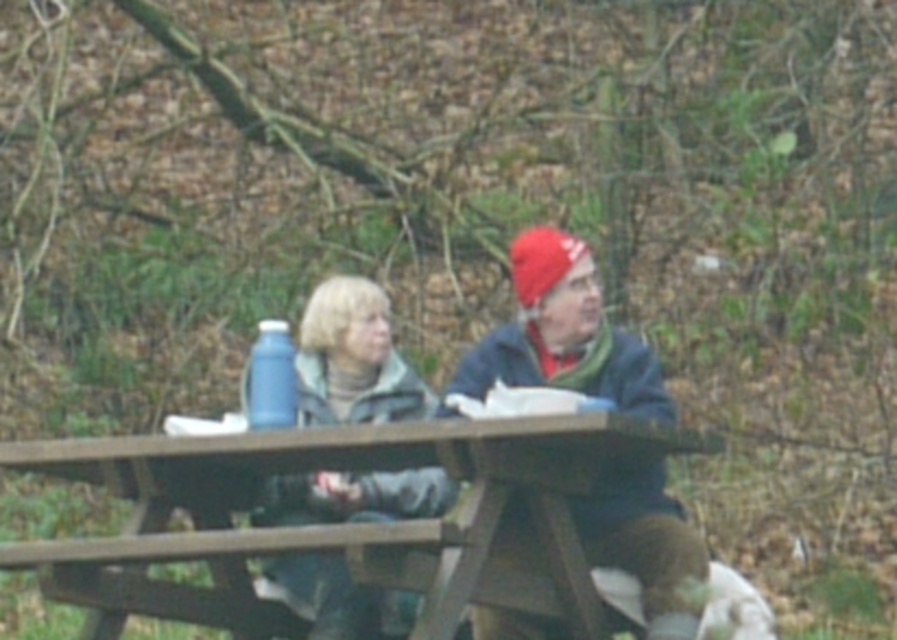
You are a photographer standing at the edge of the park and want to take a photo of the matte gray jacket at center and the blue plastic bottle at center. Considering their heights, which object will appear larger in the photo?

The matte gray jacket at center is much taller than the blue plastic bottle at center, so it will appear larger in the photo.